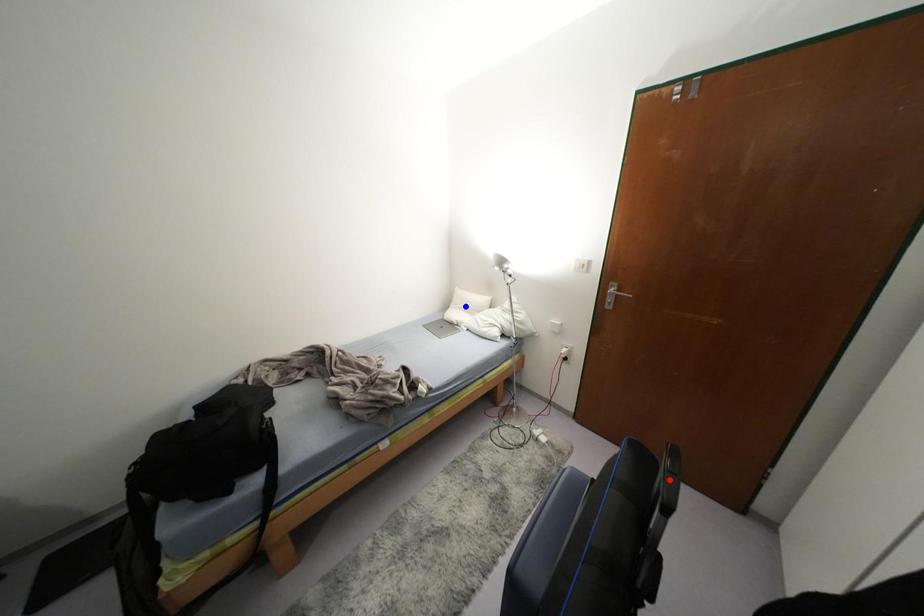
Question: Two points are marked on the image. Which point is closer to the camera?

Choices:
 (A) Blue point is closer.
 (B) Red point is closer.

Answer: (B)